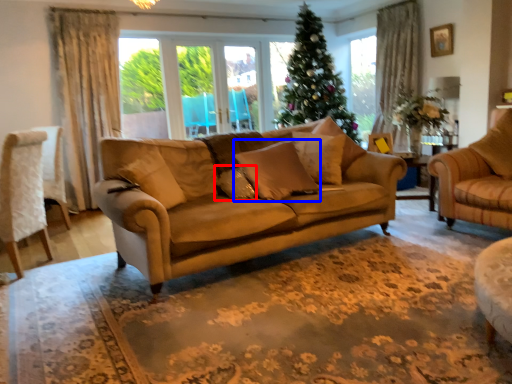
Question: Which of the following is the closest to the observer, pillow (highlighted by a red box) or pillow (highlighted by a blue box)?

Choices:
 (A) pillow
 (B) pillow

Answer: (B)